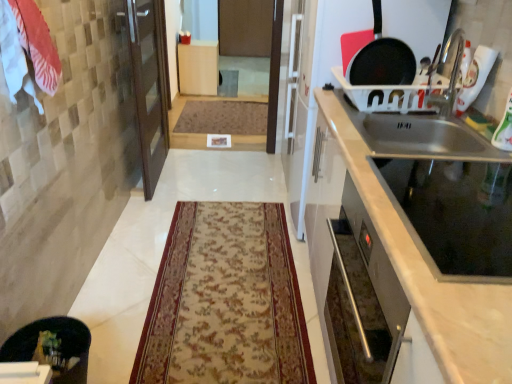
Question: Considering their positions, is beige floral rug at center, which is the 2th mat in top-to-bottom order, located in front of or behind white cotton towel at upper left?

Choices:
 (A) front
 (B) behind

Answer: (B)

Question: From a real-world perspective, is beige floral rug at center, marked as the 1th mat in a front-to-back arrangement, physically located above or below white cotton towel at upper left?

Choices:
 (A) below
 (B) above

Answer: (A)

Question: Estimate the real-world distances between objects in this image. Which object is farther from the matte wood cabinet at center, the second cabinetry in the front-to-back sequence?

Choices:
 (A) brown textured mat at center, which ranks as the first mat in top-to-bottom order
 (B) beige floral rug at center, which is the 2th mat in top-to-bottom order
 (C) satin silver oven at right, the 1th cabinetry when ordered from bottom to top
 (D) black matte frying pan at upper right
 (E) white cotton towel at upper left

Answer: (C)

Question: Based on their relative distances, which object is nearer to the beige floral rug at center, arranged as the 1th mat when ordered from the bottom?

Choices:
 (A) matte wood cabinet at center, which appears as the 1th cabinetry when viewed from the left
 (B) white cotton towel at upper left
 (C) black matte frying pan at upper right
 (D) satin silver oven at right, which is counted as the second cabinetry, starting from the left
 (E) brown textured mat at center, the second mat in the bottom-to-top sequence

Answer: (D)